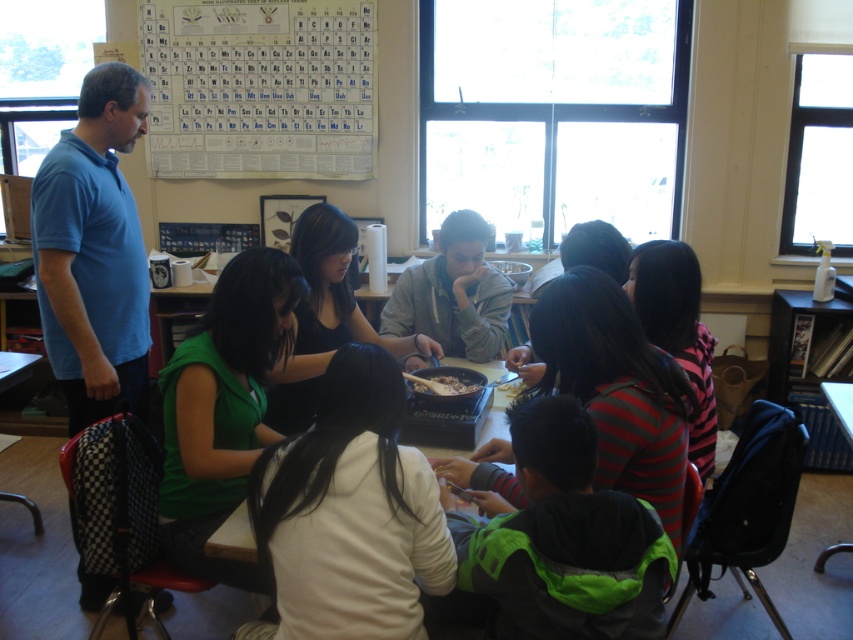
Between white paper at upper center and blue cotton shirt at left, which one is positioned lower?

Positioned lower is blue cotton shirt at left.

Does white paper at upper center appear on the left side of blue cotton shirt at left?

No, white paper at upper center is not to the left of blue cotton shirt at left.

Which is in front, point (334, 150) or point (129, 348)?

Point (129, 348) is more forward.

The width and height of the screenshot is (853, 640). What are the coordinates of `white paper at upper center` in the screenshot? It's located at (260, 88).

Does blue cotton shirt at left appear on the left side of brown matte food at center?

Correct, you'll find blue cotton shirt at left to the left of brown matte food at center.

Who is more forward, (91, 104) or (421, 378)?

Positioned in front is point (421, 378).

Locate an element on the screen. blue cotton shirt at left is located at coordinates (94, 252).

Can you confirm if white paper at upper center is smaller than brown matte food at center?

Actually, white paper at upper center might be larger than brown matte food at center.

Between white paper at upper center and brown matte food at center, which one appears on the right side from the viewer's perspective?

brown matte food at center is more to the right.

Who is more distant from viewer, [318,83] or [451,388]?

Positioned behind is point [318,83].

Locate an element on the screen. The height and width of the screenshot is (640, 853). white paper at upper center is located at coordinates point(260,88).